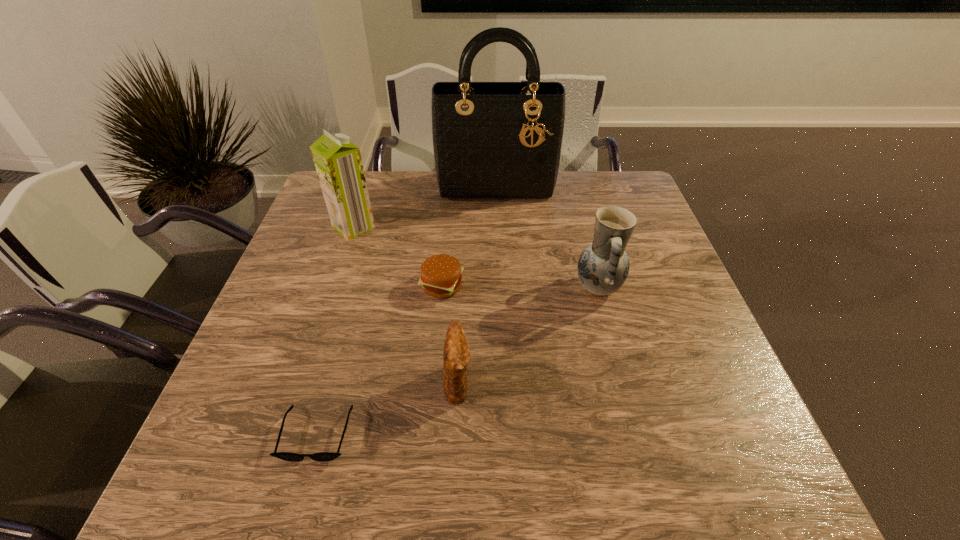
Where is `free space that satisfies the following two spatial constraints: 1. on the open side of the clutch bag; 2. on the front-facing side of the sunglasses`? Image resolution: width=960 pixels, height=540 pixels. free space that satisfies the following two spatial constraints: 1. on the open side of the clutch bag; 2. on the front-facing side of the sunglasses is located at coordinates (456, 434).

I want to click on vacant point that satisfies the following two spatial constraints: 1. at the front of the tallest object with visible charms; 2. on the open side of the clutch bag, so click(x=506, y=382).

You are a GUI agent. You are given a task and a screenshot of the screen. Output one action in this format:
    pyautogui.click(x=<x>, y=<y>)
    Task: Click on the vacant area that satisfies the following two spatial constraints: 1. at the front of the handbag with visible charms; 2. on the open side of the fourth tallest object
    The image size is (960, 540).
    Given the screenshot: What is the action you would take?
    pyautogui.click(x=506, y=382)